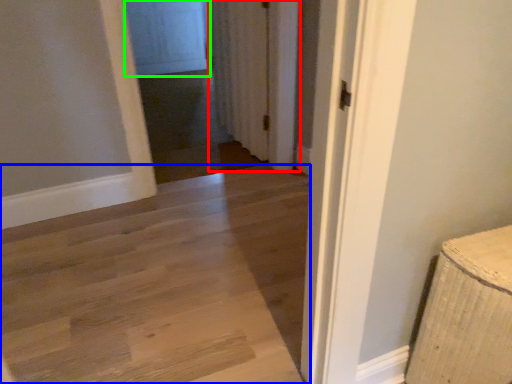
Question: Which object is positioned closest to curtain (highlighted by a red box)? Select from path (highlighted by a blue box) and screen door (highlighted by a green box).

Choices:
 (A) path
 (B) screen door

Answer: (A)